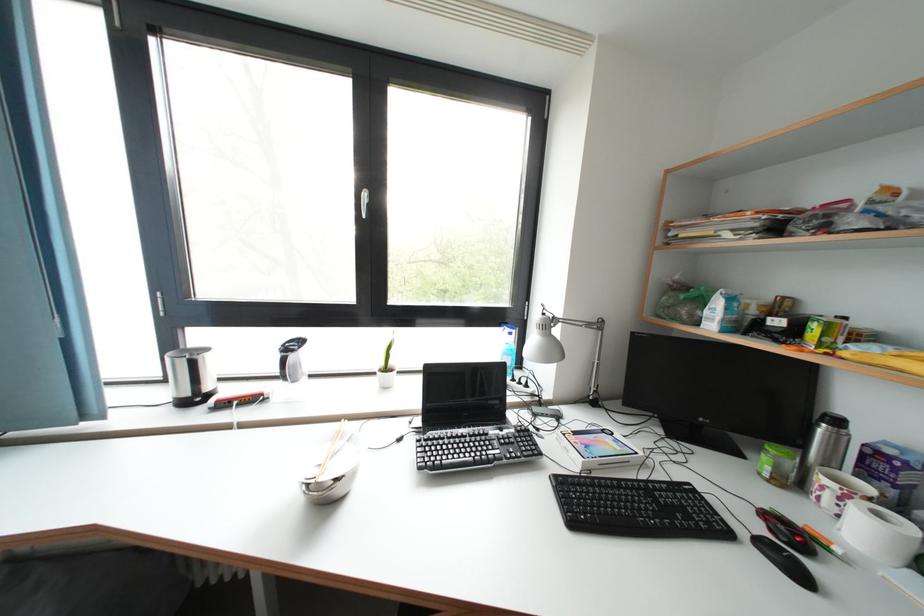
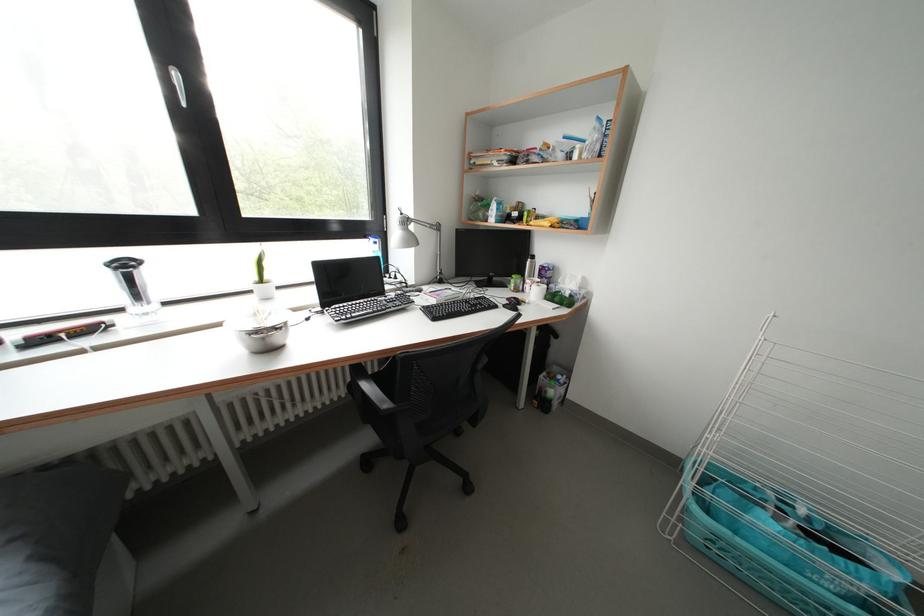
The point at (864, 342) is marked in the first image. Where is the corresponding point in the second image?

(544, 223)